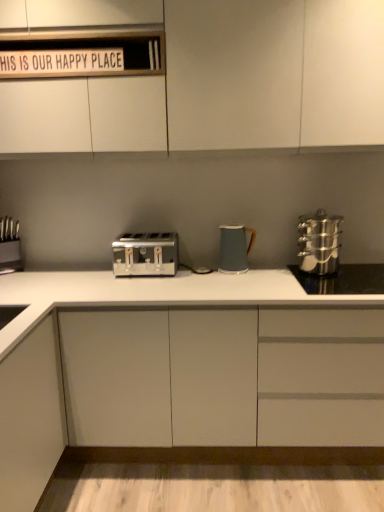
The image size is (384, 512). I want to click on free space in front of stainless steel knife block at left, so click(11, 279).